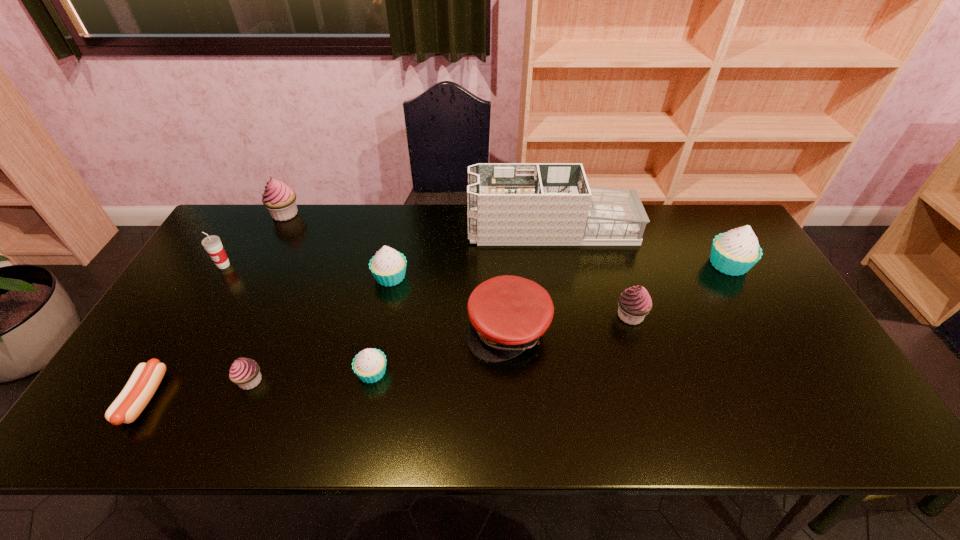
You are a GUI agent. You are given a task and a screenshot of the screen. Output one action in this format:
    pyautogui.click(x=<x>, y=<y>)
    Task: Click on the smallest white cupcake
    
    Given the screenshot: What is the action you would take?
    pyautogui.click(x=369, y=365)

The width and height of the screenshot is (960, 540). I want to click on the fifth cupcake from right to left, so click(245, 372).

Locate an element on the screen. the smallest pink cupcake is located at coordinates (245, 372).

Locate an element on the screen. The width and height of the screenshot is (960, 540). the shortest object is located at coordinates (144, 381).

This screenshot has height=540, width=960. Identify the location of brown sausage. click(x=144, y=381).

Where is `vacant space located 0.160m at the entrance of the tallest object`? vacant space located 0.160m at the entrance of the tallest object is located at coordinates (420, 228).

Locate an element on the screen. The image size is (960, 540). free space located at the entrance of the tallest object is located at coordinates (355, 228).

Image resolution: width=960 pixels, height=540 pixels. What are the coordinates of `vacant region located at the entrance of the tallest object` in the screenshot? It's located at (423, 228).

This screenshot has width=960, height=540. Find the location of `blank space located 0.390m on the front of the leftmost cupcake`. blank space located 0.390m on the front of the leftmost cupcake is located at coordinates (235, 311).

Locate an element on the screen. free space located on the front of the rightmost object is located at coordinates (774, 343).